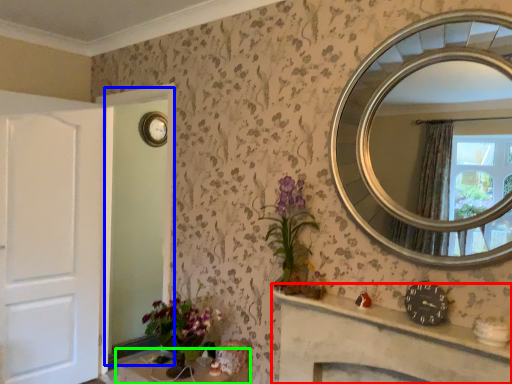
Question: Which object is positioned farthest from vanity (highlighted by a red box)? Select from glass door (highlighted by a blue box) and table (highlighted by a green box).

Choices:
 (A) glass door
 (B) table

Answer: (A)